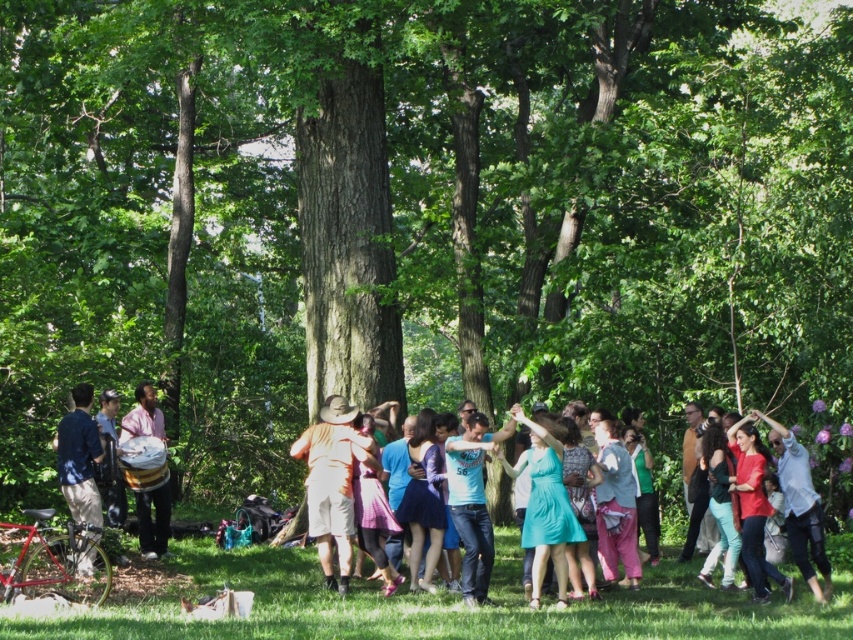
You are standing at the point labeled as point (x=332, y=400) in the image. You want to walk towards the point labeled as point (x=827, y=612). Which direction should you move to reach your destination?

You should move forward because point (x=827, y=612) is in front of point (x=332, y=400).

You are planning to set up a small stage for a performance in the forest area shown. The stage needs to be placed where the green grass at lower center and the matte brown drum at left are currently located. Which location has more space to accommodate the stage?

The green grass at lower center has more space to accommodate the stage because its width is larger than that of the matte brown drum at left.